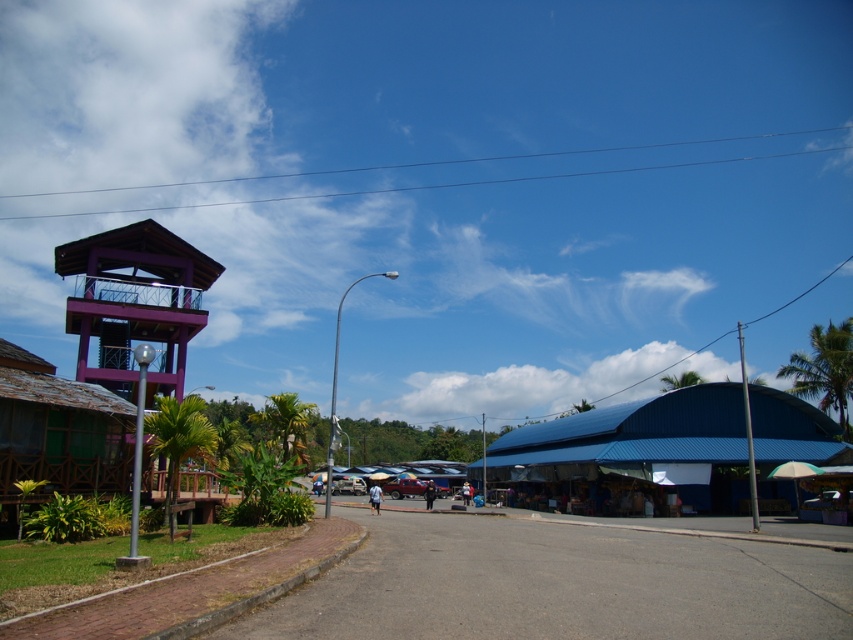
You are a tourist standing on the paved road in the image. You want to take a photo of the blue corrugated metal hut at center and the green wooden hut at left. Which one should you point your camera towards first if you want to capture both in a single frame without moving your position?

The blue corrugated metal hut at center is below the green wooden hut at left, so you should point your camera towards the green wooden hut at left first to ensure both are in the frame.